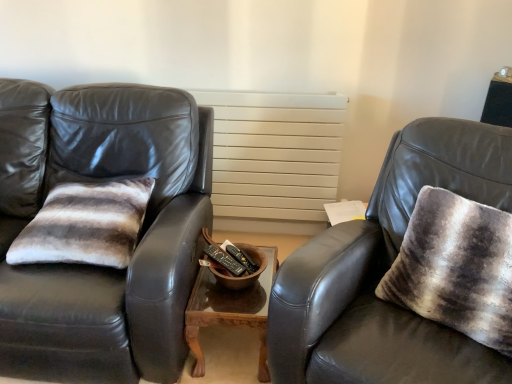
Question: From a real-world perspective, is wooden table at center on textured gray throw pillow at right?

Choices:
 (A) yes
 (B) no

Answer: (B)

Question: Can you confirm if wooden table at center is wider than textured gray throw pillow at right?

Choices:
 (A) no
 (B) yes

Answer: (B)

Question: Can you confirm if wooden table at center is positioned to the left of textured gray throw pillow at right?

Choices:
 (A) no
 (B) yes

Answer: (B)

Question: Is wooden table at center outside of textured gray throw pillow at right?

Choices:
 (A) no
 (B) yes

Answer: (B)

Question: Are wooden table at center and textured gray throw pillow at right located far from each other?

Choices:
 (A) no
 (B) yes

Answer: (A)

Question: Does wooden table at center have a smaller size compared to textured gray throw pillow at right?

Choices:
 (A) no
 (B) yes

Answer: (B)

Question: Considering the relative sizes of textured gray throw pillow at right and matte black leather chair at right in the image provided, is textured gray throw pillow at right thinner than matte black leather chair at right?

Choices:
 (A) yes
 (B) no

Answer: (A)

Question: From the image's perspective, is textured gray throw pillow at right located beneath matte black leather chair at right?

Choices:
 (A) yes
 (B) no

Answer: (B)

Question: Is textured gray throw pillow at right wider than matte black leather chair at right?

Choices:
 (A) yes
 (B) no

Answer: (B)

Question: Is textured gray throw pillow at right closer to camera compared to matte black leather chair at right?

Choices:
 (A) no
 (B) yes

Answer: (A)

Question: From the image's perspective, is textured gray throw pillow at right located above matte black leather chair at right?

Choices:
 (A) no
 (B) yes

Answer: (B)

Question: Does textured gray throw pillow at right come behind matte black leather chair at right?

Choices:
 (A) no
 (B) yes

Answer: (B)

Question: Could textured gray throw pillow at right be considered to be inside matte black leather chair at right?

Choices:
 (A) no
 (B) yes

Answer: (B)